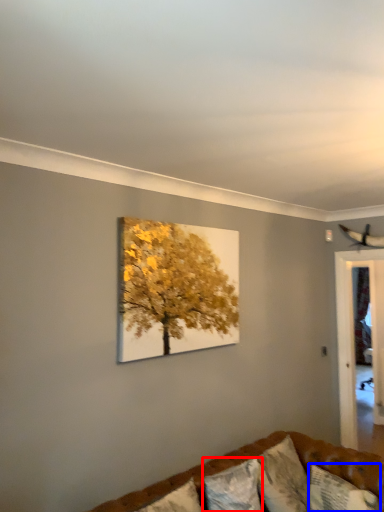
Question: Which object appears farthest to the camera in this image, pillow (highlighted by a red box) or pillow (highlighted by a blue box)?

Choices:
 (A) pillow
 (B) pillow

Answer: (B)